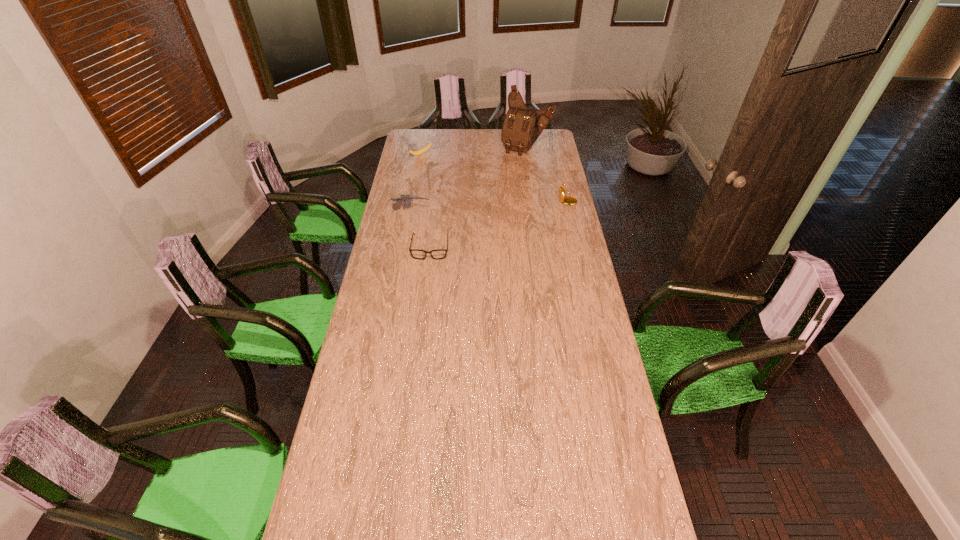
Find the location of `free space that satisfies the following two spatial constraints: 1. on the front side of the banana; 2. on the face of the third nearest object`. free space that satisfies the following two spatial constraints: 1. on the front side of the banana; 2. on the face of the third nearest object is located at coordinates (413, 199).